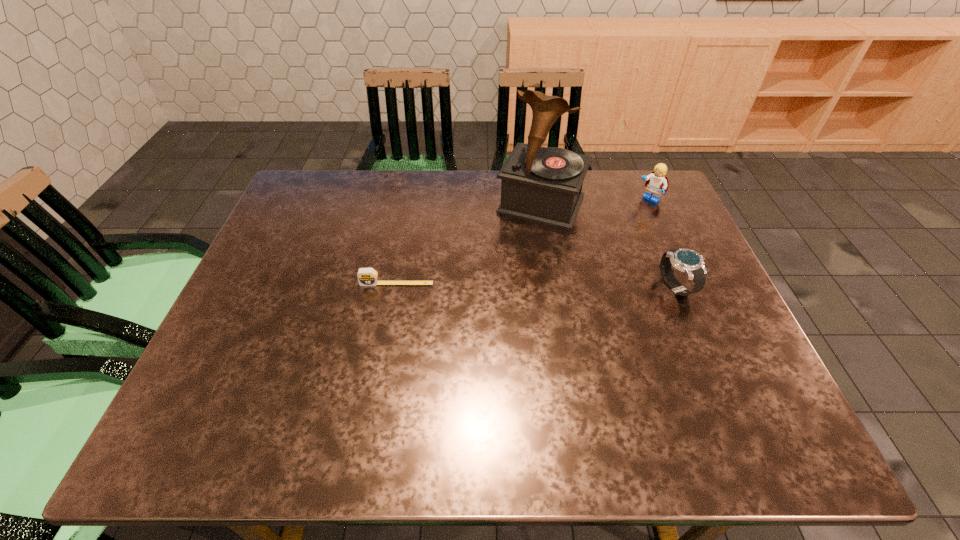
Where is `free space on the desktop that is between the leftmost object and the second shortest object and is positioned at the horn opening of the second object from left to right`? free space on the desktop that is between the leftmost object and the second shortest object and is positioned at the horn opening of the second object from left to right is located at coordinates (503, 285).

Image resolution: width=960 pixels, height=540 pixels. Identify the location of vacant space on the desktop that is between the shortest object and the watch and is positioned on the front-facing side of the second tallest object. (554, 286).